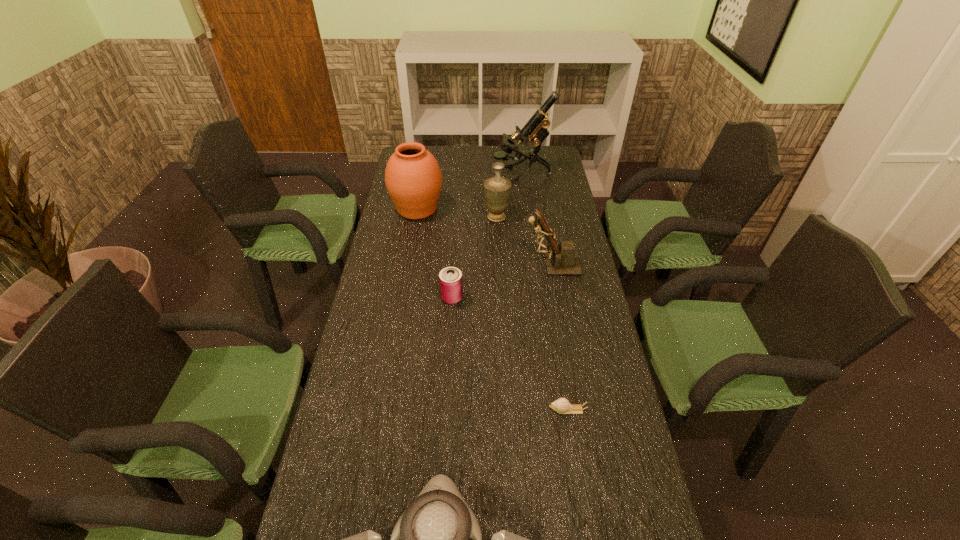
Locate an element on the screen. The image size is (960, 540). object at the far edge is located at coordinates (536, 128).

Find the location of a particular element. Image resolution: width=960 pixels, height=540 pixels. object present at the left edge is located at coordinates (413, 178).

Where is `microscope located at the right edge`? This screenshot has height=540, width=960. microscope located at the right edge is located at coordinates (536, 128).

What are the coordinates of `figurine present at the right edge` in the screenshot? It's located at pos(563,259).

Find the location of a particular element. escargot at the right edge is located at coordinates (562, 406).

The image size is (960, 540). What are the coordinates of `object that is at the far right corner` in the screenshot? It's located at (536, 128).

Find the location of a particular element. The width and height of the screenshot is (960, 540). blank area at the far edge is located at coordinates (470, 146).

In the image, there is a desktop. Identify the location of vacant space at the left edge. (396, 247).

Locate an element on the screen. Image resolution: width=960 pixels, height=540 pixels. free spot at the right edge of the desktop is located at coordinates (608, 408).

This screenshot has height=540, width=960. I want to click on vacant space that is in between the left urn and the farthest object, so click(x=469, y=191).